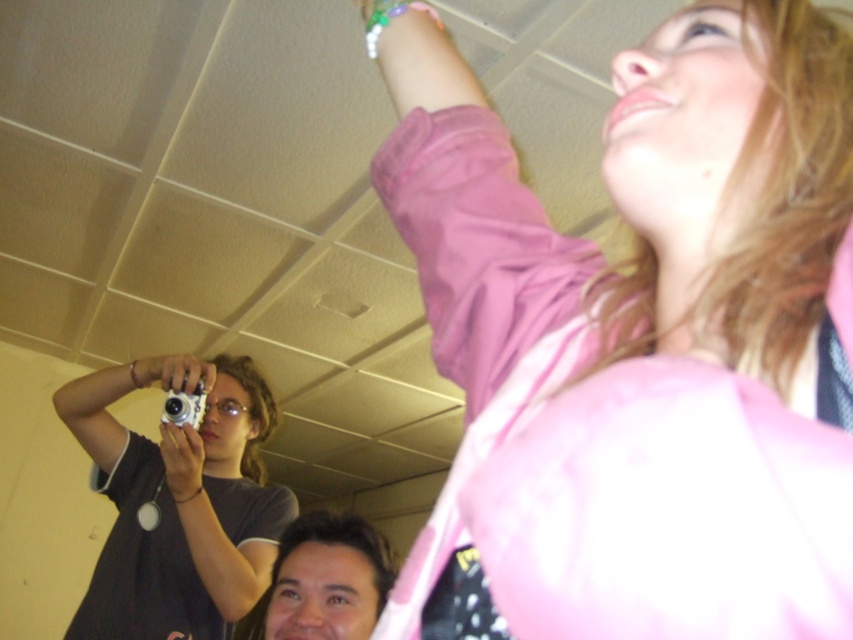
Question: Can you confirm if pink fabric at upper right is positioned to the right of smooth brown hair at lower center?

Choices:
 (A) no
 (B) yes

Answer: (B)

Question: Based on their relative distances, which object is nearer to the pink fabric at upper right?

Choices:
 (A) matte silver camera at upper left
 (B) silver metallic camera at upper left
 (C) dark gray fabric camera at lower left

Answer: (C)

Question: Can you confirm if dark gray fabric camera at lower left is positioned to the right of matte silver camera at upper left?

Choices:
 (A) no
 (B) yes

Answer: (A)

Question: Which of the following is the farthest from the observer?

Choices:
 (A) (108, 480)
 (B) (486, 371)
 (C) (375, 576)
 (D) (189, 496)

Answer: (A)

Question: Which of the following is the farthest from the observer?

Choices:
 (A) dark gray fabric camera at lower left
 (B) pink fabric at upper right
 (C) smooth brown hair at lower center
 (D) matte silver camera at upper left

Answer: (D)

Question: Is pink fabric at upper right to the right of dark gray fabric camera at lower left from the viewer's perspective?

Choices:
 (A) no
 (B) yes

Answer: (B)